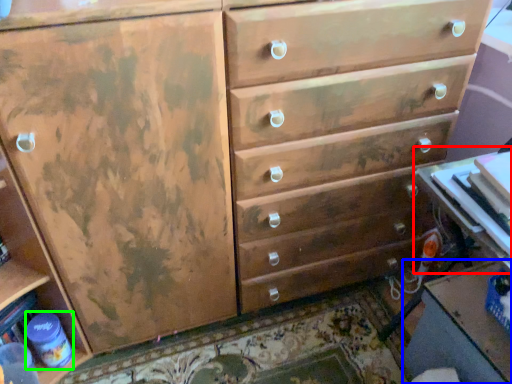
Question: Estimate the real-world distances between objects in this image. Which object is closer to table (highlighted by a red box), table (highlighted by a blue box) or bottle (highlighted by a green box)?

Choices:
 (A) table
 (B) bottle

Answer: (A)